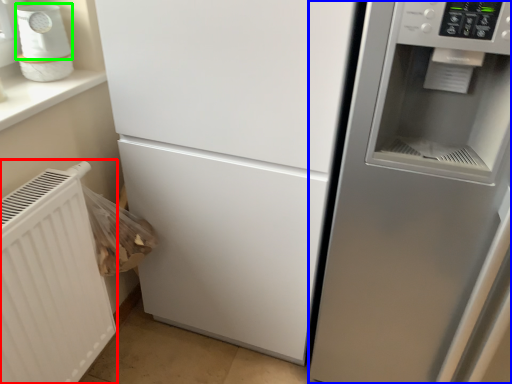
Question: Based on their relative distances, which object is farther from radiator (highlighted by a red box)? Choose from fridge (highlighted by a blue box) and appliance (highlighted by a green box).

Choices:
 (A) fridge
 (B) appliance

Answer: (A)